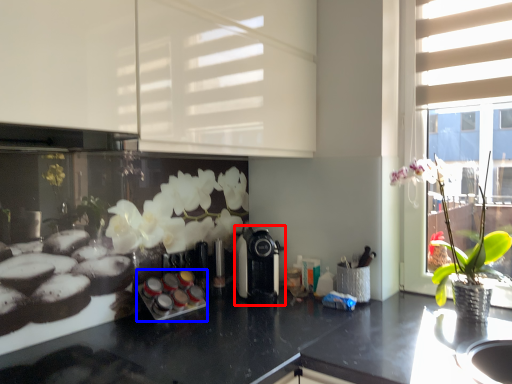
Question: Among these objects, which one is farthest to the camera, coffee machine (highlighted by a red box) or appliance (highlighted by a blue box)?

Choices:
 (A) coffee machine
 (B) appliance

Answer: (A)